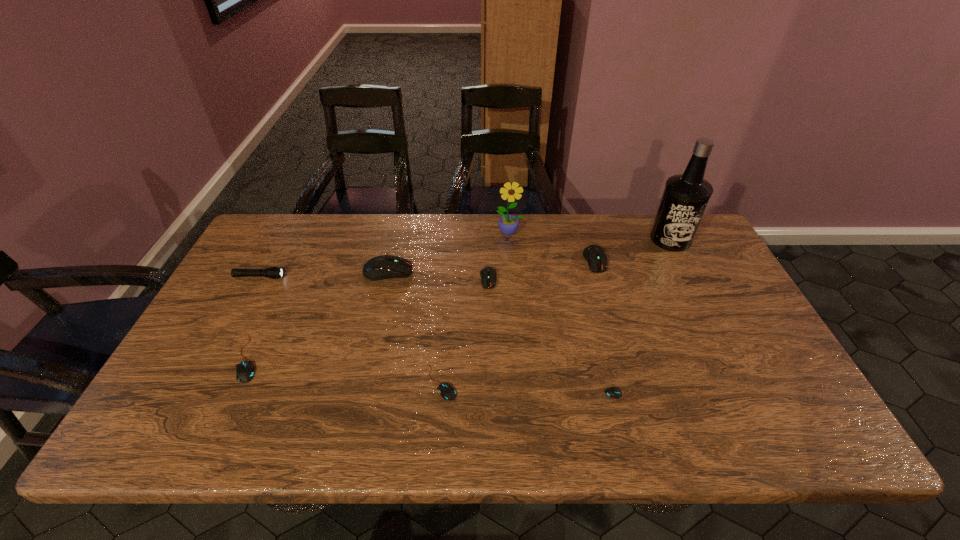
Where is `the closest mouse to the smallest dark computer equipment`? Image resolution: width=960 pixels, height=540 pixels. the closest mouse to the smallest dark computer equipment is located at coordinates (381, 267).

Where is `dark computer equipment that stands as the closest to the flashlight`? The height and width of the screenshot is (540, 960). dark computer equipment that stands as the closest to the flashlight is located at coordinates (381, 267).

This screenshot has width=960, height=540. Identify the location of dark computer equipment that is the second closest to the second biggest dark computer equipment. click(381, 267).

Locate an element on the screen. The height and width of the screenshot is (540, 960). black mouse that stands as the third closest to the tallest mouse is located at coordinates (613, 392).

Find the location of a particular element. black mouse that is the second nearest to the fifth mouse from right to left is located at coordinates (447, 391).

What are the coordinates of `free location that satisfies the following two spatial constraints: 1. at the lens end of the shortest object; 2. on the left side of the flashlight` in the screenshot? It's located at (196, 396).

I want to click on vacant region that satisfies the following two spatial constraints: 1. on the back side of the fourth object from left to right; 2. on the button of the seventh object from right to left, so click(x=449, y=272).

Locate an element on the screen. free region that satisfies the following two spatial constraints: 1. at the lens end of the flashlight; 2. on the right side of the smallest black mouse is located at coordinates (196, 396).

Where is `blank space that satisfies the following two spatial constraints: 1. on the button of the seventh shortest object; 2. on the left side of the rightmost black mouse`? Image resolution: width=960 pixels, height=540 pixels. blank space that satisfies the following two spatial constraints: 1. on the button of the seventh shortest object; 2. on the left side of the rightmost black mouse is located at coordinates (359, 396).

Find the location of a particular element. The image size is (960, 540). vacant space that satisfies the following two spatial constraints: 1. on the front label of the tallest object; 2. on the button of the seventh object from right to left is located at coordinates (686, 272).